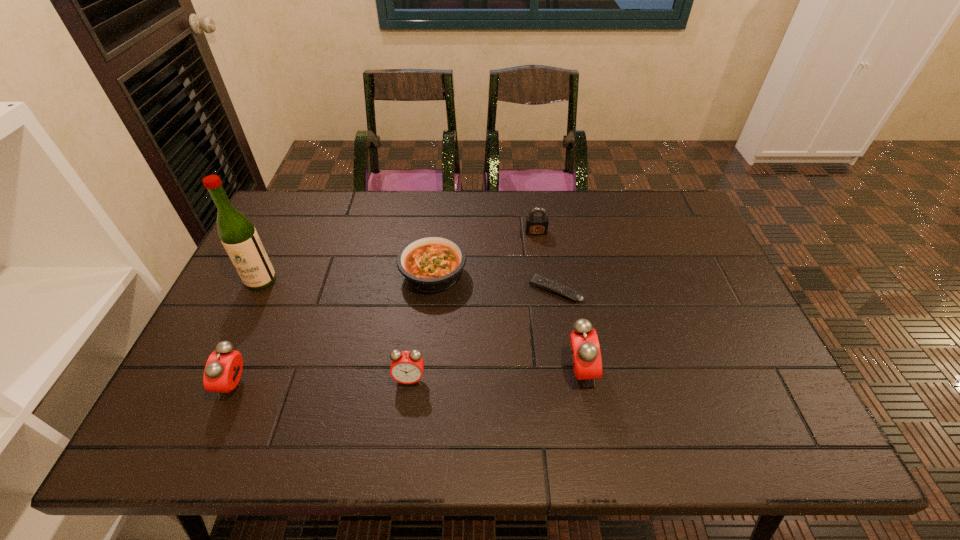
Identify the location of free space at the near edge of the desktop. The image size is (960, 540). (431, 376).

This screenshot has width=960, height=540. In the image, there is a desktop. What are the coordinates of `vacant space at the left edge` in the screenshot? It's located at (285, 279).

The height and width of the screenshot is (540, 960). In order to click on free space at the right edge of the desktop in this screenshot , I will do `click(702, 287)`.

Image resolution: width=960 pixels, height=540 pixels. Find the location of `vacant position at the far right corner of the desktop`. vacant position at the far right corner of the desktop is located at coordinates (663, 227).

This screenshot has height=540, width=960. Find the location of `vacant area at the near right corner`. vacant area at the near right corner is located at coordinates (746, 386).

The width and height of the screenshot is (960, 540). I want to click on vacant area that lies between the shortest alarm clock and the tallest object, so [335, 329].

The height and width of the screenshot is (540, 960). Identify the location of free space between the sixth tallest object and the second alarm clock from left to right. (421, 326).

This screenshot has width=960, height=540. I want to click on vacant space that's between the shortest alarm clock and the stew, so click(421, 326).

Identify the location of empty space between the second alarm clock from right to left and the third tallest object. (323, 382).

Where is `empty space between the remote control and the liquor`? The width and height of the screenshot is (960, 540). empty space between the remote control and the liquor is located at coordinates (408, 285).